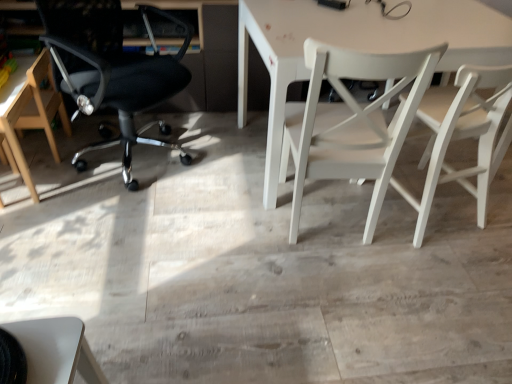
Identify the location of vacant space to the right of white matte chair at center, the third chair from the left. (430, 253).